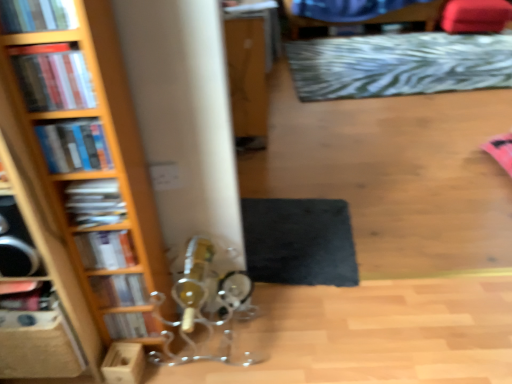
Question: Is hardcover book at left, which appears as the second book when viewed from the back, thinner than wooden bookcase at left?

Choices:
 (A) yes
 (B) no

Answer: (A)

Question: Is hardcover book at left, which appears as the second book when viewed from the back, located outside wooden bookcase at left?

Choices:
 (A) no
 (B) yes

Answer: (A)

Question: Is the position of hardcover book at left, the sixth book positioned from the front, more distant than that of wooden bookcase at left?

Choices:
 (A) yes
 (B) no

Answer: (A)

Question: From the image's perspective, is hardcover book at left, acting as the 6th book starting from the top, above wooden bookcase at left?

Choices:
 (A) no
 (B) yes

Answer: (A)

Question: Does hardcover book at left, the 2th book in the bottom-to-top sequence, have a greater height compared to wooden bookcase at left?

Choices:
 (A) yes
 (B) no

Answer: (B)

Question: Do you think matte black book at left, arranged as the 4th book when viewed from the front, is within zebra-patterned rug at upper center, positioned as the first mat in top-to-bottom order, or outside of it?

Choices:
 (A) inside
 (B) outside

Answer: (B)

Question: From the image's perspective, is matte black book at left, placed as the fourth book when sorted from bottom to top, above or below zebra-patterned rug at upper center, the first mat when ordered from back to front?

Choices:
 (A) above
 (B) below

Answer: (B)

Question: Visually, is matte black book at left, placed as the fourth book when sorted from bottom to top, positioned to the left or to the right of zebra-patterned rug at upper center, which is the 2th mat from front to back?

Choices:
 (A) left
 (B) right

Answer: (A)

Question: Does point (94, 208) appear closer or farther from the camera than point (295, 89)?

Choices:
 (A) farther
 (B) closer

Answer: (B)

Question: Is hardcover book at upper left, marked as the first book in a front-to-back arrangement, spatially inside zebra-patterned rug at upper center, which is counted as the 2th mat, starting from the left, or outside of it?

Choices:
 (A) inside
 (B) outside

Answer: (B)

Question: Looking at their shapes, would you say hardcover book at upper left, which is the 7th book in bottom-to-top order, is wider or thinner than zebra-patterned rug at upper center, positioned as the 2th mat in bottom-to-top order?

Choices:
 (A) thin
 (B) wide

Answer: (A)

Question: In the image, is hardcover book at upper left, which is counted as the first book, starting from the top, positioned in front of or behind zebra-patterned rug at upper center, positioned as the first mat in top-to-bottom order?

Choices:
 (A) front
 (B) behind

Answer: (A)

Question: Considering the positions of point (74, 21) and point (433, 66), is point (74, 21) closer or farther from the camera than point (433, 66)?

Choices:
 (A) closer
 (B) farther

Answer: (A)

Question: Is point (443, 3) positioned closer to the camera than point (108, 327)?

Choices:
 (A) closer
 (B) farther

Answer: (B)

Question: Considering the positions of blue fabric swivel chair at upper center and hardcover book at lower left, which appears as the 7th book when viewed from the top, in the image, is blue fabric swivel chair at upper center taller or shorter than hardcover book at lower left, which appears as the 7th book when viewed from the top,?

Choices:
 (A) short
 (B) tall

Answer: (B)